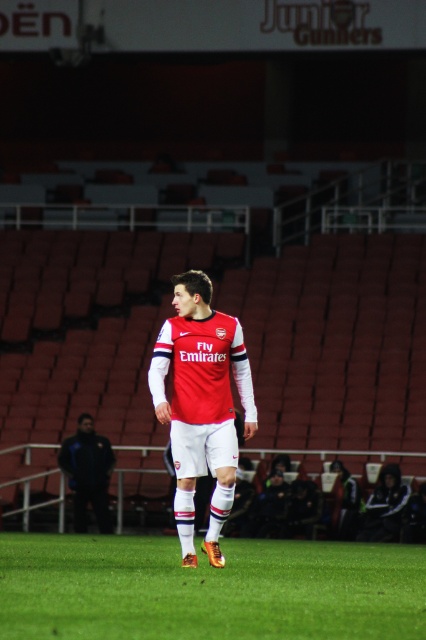
Does matte red jersey at center lie behind dark blue jacket at lower left?

No, matte red jersey at center is closer to the viewer.

From the picture: Which of these two, matte red jersey at center or dark blue jacket at lower left, stands taller?

Standing taller between the two is matte red jersey at center.

Does point (229, 316) come farther from viewer compared to point (74, 508)?

No, it is not.

Locate an element on the screen. matte red jersey at center is located at coordinates (201, 404).

Which is more to the left, green grass at center or dark blue jacket at lower left?

dark blue jacket at lower left is more to the left.

Based on the photo, does green grass at center appear on the left side of dark blue jacket at lower left?

No, green grass at center is not to the left of dark blue jacket at lower left.

Who is more distant from viewer, [270,636] or [74,468]?

Positioned behind is point [74,468].

Where is `green grass at center`? green grass at center is located at coordinates (209, 589).

In the scene shown: Can you confirm if green grass at center is bigger than matte red jersey at center?

Yes.

Locate an element on the screen. green grass at center is located at coordinates (209, 589).